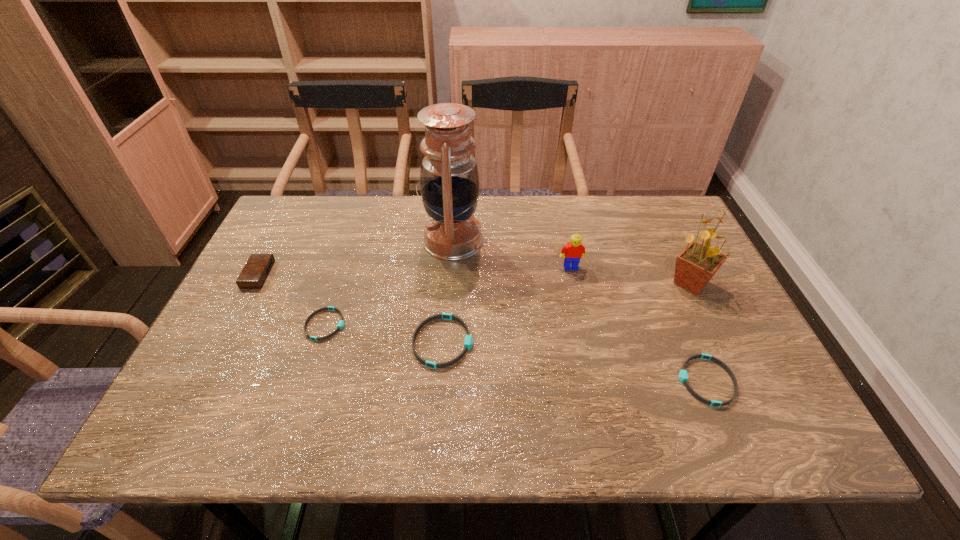
Identify the location of free point that satisfies the following two spatial constraints: 1. on the front-facing side of the Lego; 2. on the buckle of the fifth tallest object. Image resolution: width=960 pixels, height=540 pixels. (588, 342).